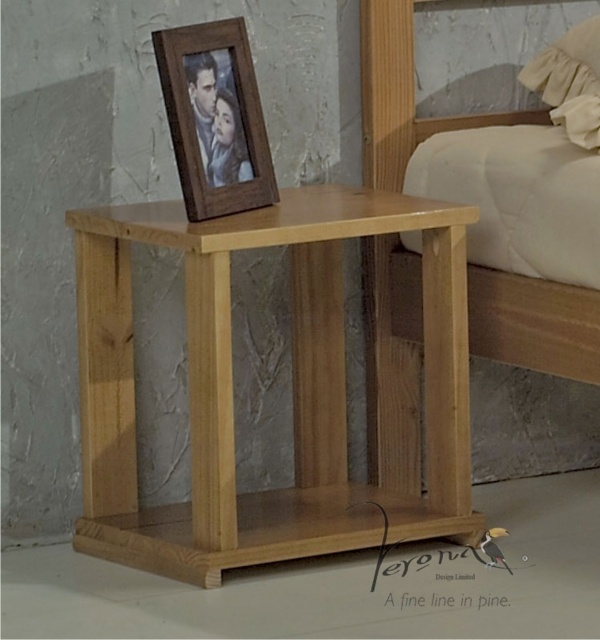
Question: Is natural wood bed at center in front of beige fabric pillow at upper right?

Choices:
 (A) no
 (B) yes

Answer: (B)

Question: Which object is the closest to the beige fabric pillow at upper right?

Choices:
 (A) natural wood bed at center
 (B) wooden photo frame at upper center

Answer: (A)

Question: Does natural wood bed at center have a larger size compared to wooden photo frame at upper center?

Choices:
 (A) no
 (B) yes

Answer: (B)

Question: Which of the following is the closest to the observer?

Choices:
 (A) (277, 512)
 (B) (190, 54)
 (C) (594, 54)
 (D) (388, 376)

Answer: (B)

Question: Which point is farther from the camera taking this photo?

Choices:
 (A) (586, 100)
 (B) (213, 577)

Answer: (A)

Question: Is natural wood side table at center below wooden photo frame at upper center?

Choices:
 (A) no
 (B) yes

Answer: (B)